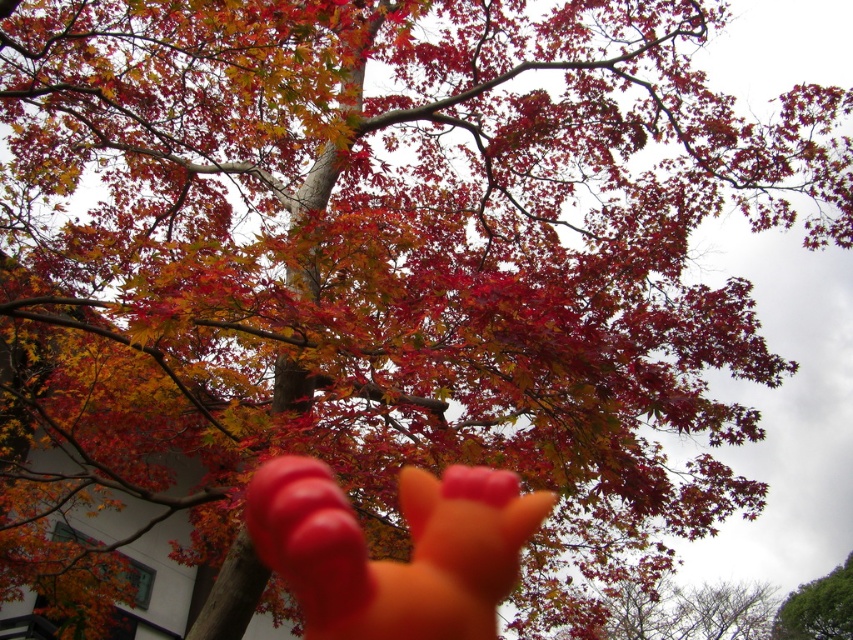
You are an artist painting this autumn scene. You need to decide the size of the orange matte hand at lower center and the green leafy tree at lower right on your canvas. Which object should you make smaller to maintain the scene proportions?

The orange matte hand at lower center is smaller than the green leafy tree at lower right, so you should paint the orange matte hand at lower center smaller than the green leafy tree at lower right to maintain the scene proportions.

You are standing in front of the autumn tree scene. There are two points marked in the image, one at coordinates point [380,605] and another at point [775,632]. Which point is nearer to you?

Point [380,605] is closer to the viewer than point [775,632].

You are an artist observing the autumn scene. You notice the orange matte hand at lower center and the green leafy tree at lower right. Which object is closer to you, the observer?

The orange matte hand at lower center is closer to you because it is positioned over the green leafy tree at lower right, indicating it is in a more foreground layer.